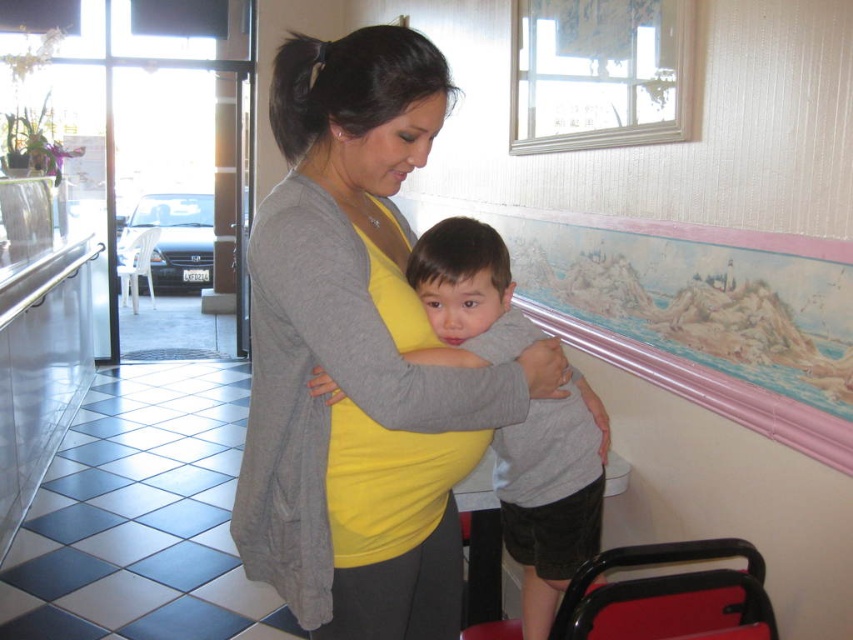
Does matte gray cardigan at center have a lesser width compared to gray matte shirt at center?

Incorrect, matte gray cardigan at center's width is not less than gray matte shirt at center's.

Does point (288, 173) lie in front of point (461, 308)?

That is True.

Who is more distant from viewer, (403, 134) or (561, 460)?

Positioned behind is point (561, 460).

This screenshot has height=640, width=853. What are the coordinates of `matte gray cardigan at center` in the screenshot? It's located at (358, 355).